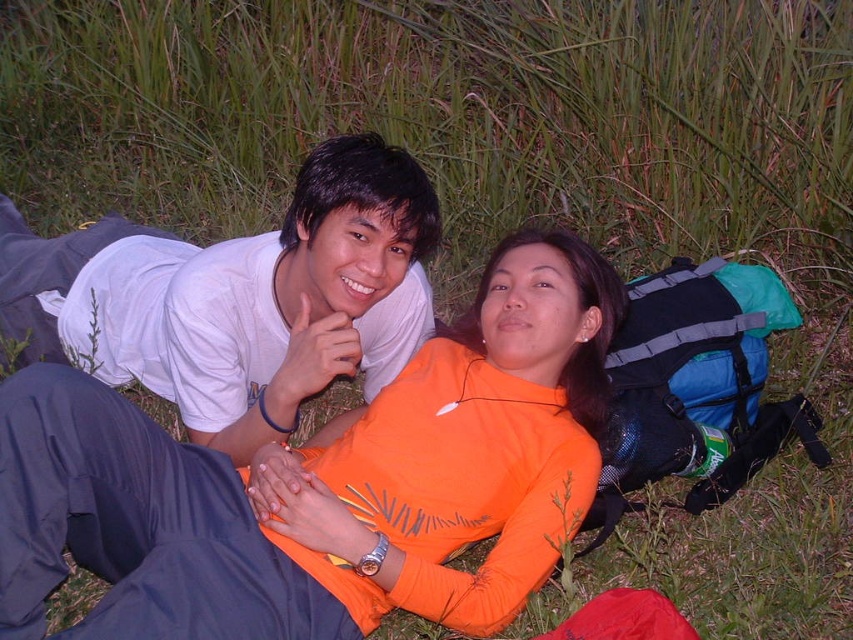
You are standing 1.5 meters away from the orange fleece at center. Can you reach it without moving your feet?

The orange fleece at center is 1.30 meters away from the viewer, so yes, you can reach it without moving your feet since it is within arm reach.

You are standing in the scene and want to place a small flag exactly at the point labeled as point (325, 483). Which object from the scene should you look for to ensure the flag is placed correctly?

The point (325, 483) is on the orange fleece at center, so you should place the flag there.